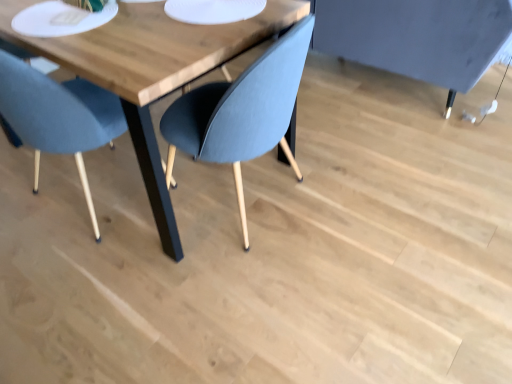
Image resolution: width=512 pixels, height=384 pixels. Find the location of `free spot in front of matte blue chair at left`. free spot in front of matte blue chair at left is located at coordinates (78, 279).